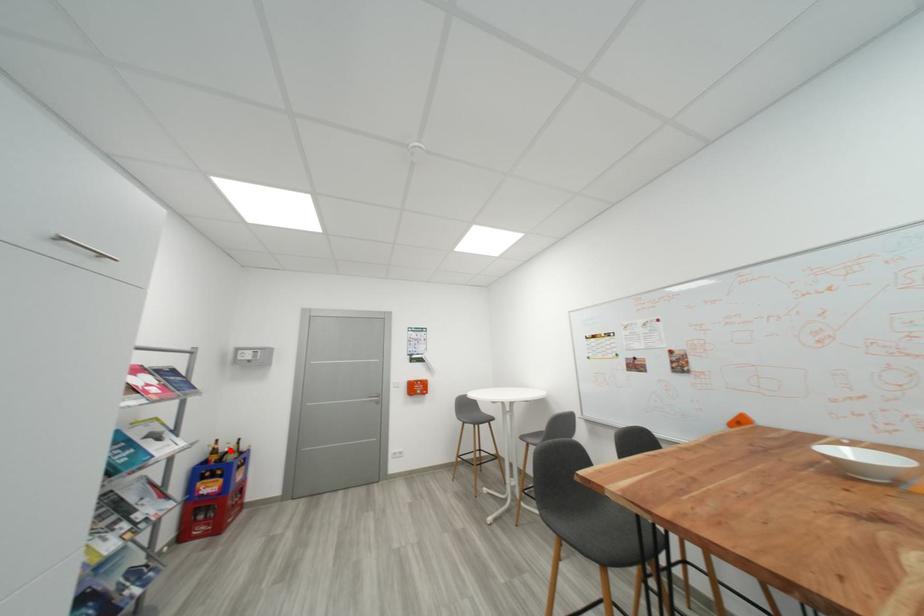
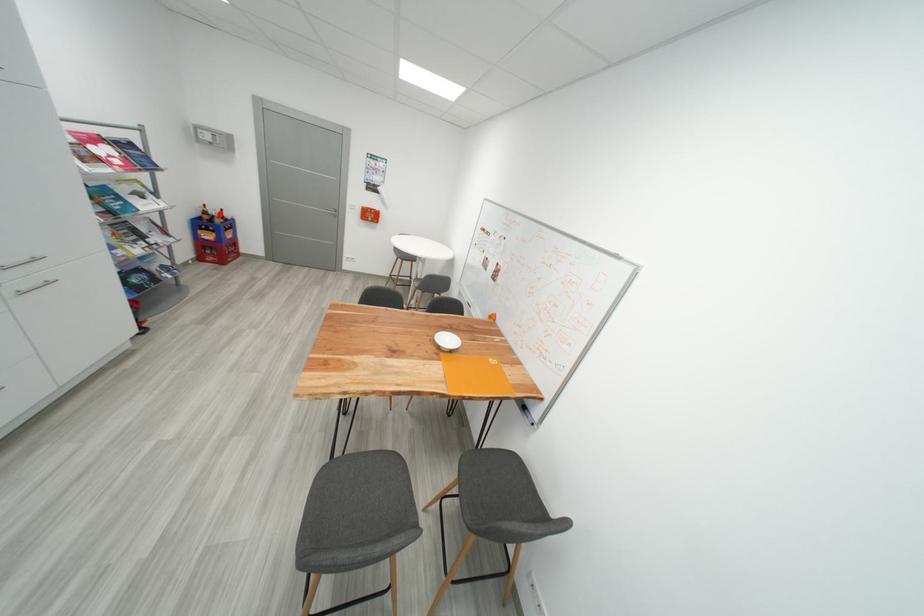
I am providing you with two images of the same scene from different viewpoints. A red point is marked on the first image and another point is marked on the second image. Is the red point in image1 aligned with the point shown in image2?

Yes